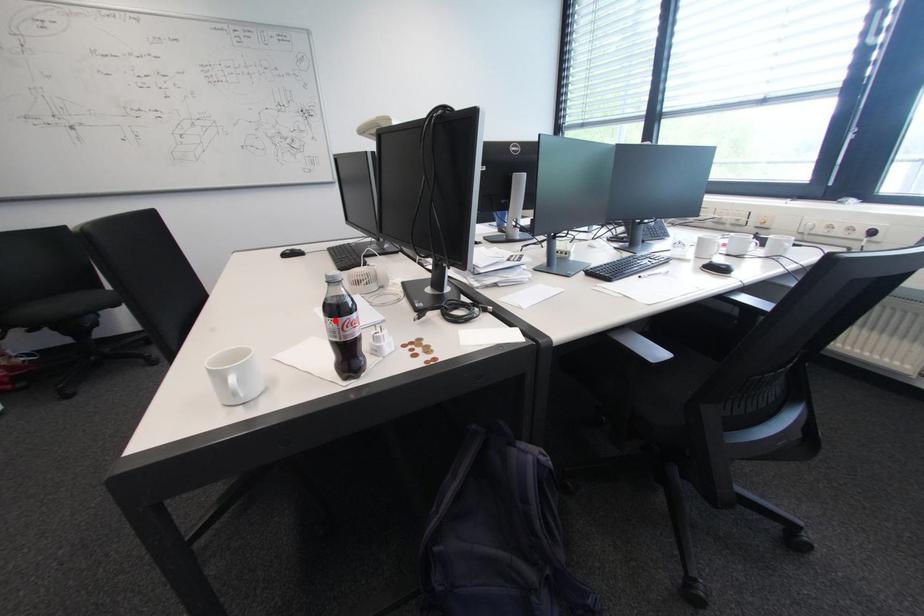
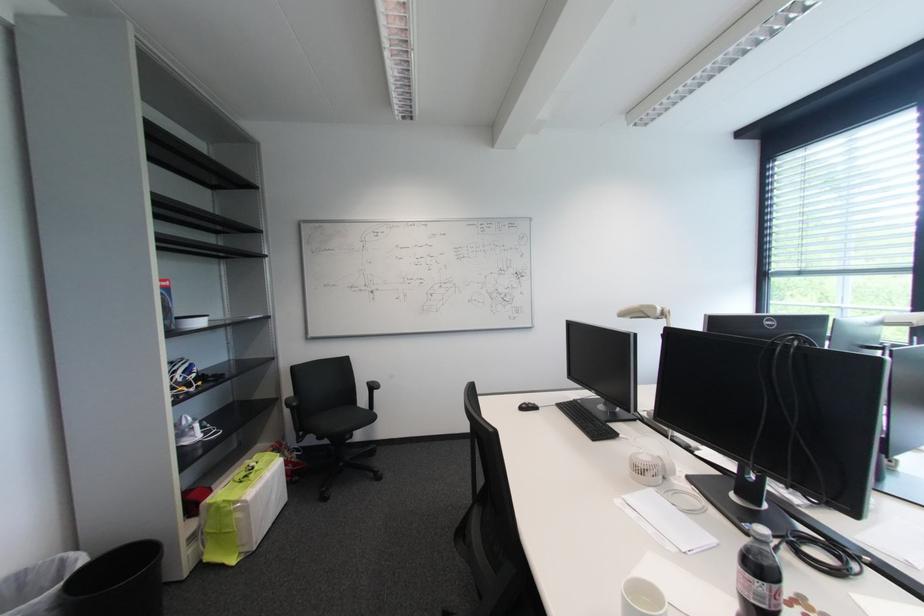
Question: A red point is marked in image1. In image2, is the corresponding 3D point closer to the camera or farther? Reply with the corresponding letter.

Choices:
 (A) The corresponding 3D point is closer.
 (B) The corresponding 3D point is farther.

Answer: (A)